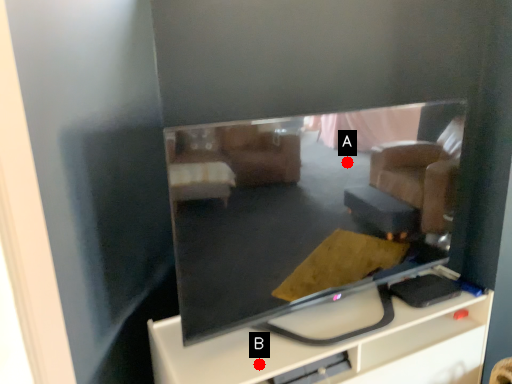
Question: Two points are circled on the image, labeled by A and B beside each circle. Which point is further to the camera?

Choices:
 (A) A is further
 (B) B is further

Answer: (A)